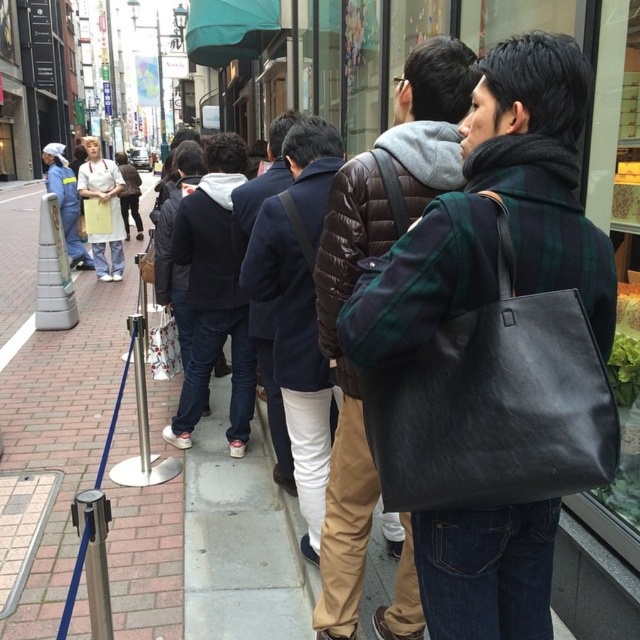
Question: Can you confirm if green plaid coat at center is positioned above matte black bag at center?

Choices:
 (A) yes
 (B) no

Answer: (A)

Question: Which point is closer to the camera?

Choices:
 (A) (557, 204)
 (B) (275, 436)
 (C) (316, 116)
 (D) (381, 246)

Answer: (A)

Question: Can you confirm if matte black bag at center is bigger than dark blue wool coat at center?

Choices:
 (A) yes
 (B) no

Answer: (A)

Question: Can you confirm if matte black bag at center is smaller than dark blue jacket at center?

Choices:
 (A) yes
 (B) no

Answer: (B)

Question: Which point is closer to the camera taking this photo?

Choices:
 (A) (435, 65)
 (B) (289, 115)
 (C) (538, 616)
 (D) (336, 163)

Answer: (C)

Question: Which of these objects is positioned farthest from the green plaid coat at center?

Choices:
 (A) dark blue jacket at center
 (B) dark blue wool coat at center
 (C) matte black bag at center

Answer: (A)